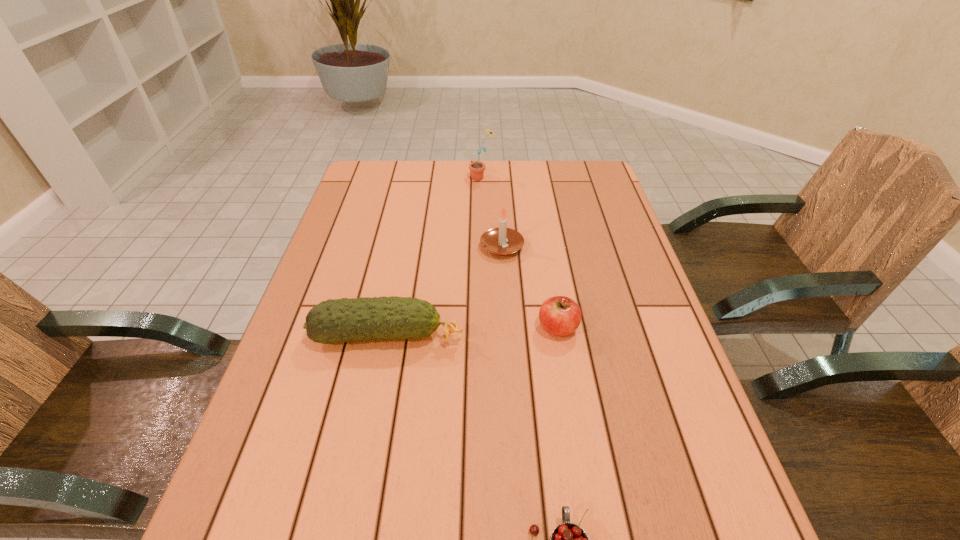
Identify the location of free point between the cucumber and the apple. The image size is (960, 540). (473, 332).

In order to click on free space between the cucumber and the fourth shortest object in this screenshot , I will do `click(444, 291)`.

The width and height of the screenshot is (960, 540). Identify the location of free spot between the cucumber and the candle. (444, 291).

At what (x,y) coordinates should I click in order to perform the action: click on vacant space in between the tallest object and the apple. Please return your answer as a coordinate pair (x, y). Image resolution: width=960 pixels, height=540 pixels. Looking at the image, I should click on (520, 253).

Where is `free spot between the fourth shortest object and the tallest object`? The height and width of the screenshot is (540, 960). free spot between the fourth shortest object and the tallest object is located at coordinates (492, 212).

The image size is (960, 540). Find the location of `object that stands as the third closest to the apple`. object that stands as the third closest to the apple is located at coordinates (568, 539).

Select which object appears as the closest to the cucumber. Please provide its 2D coordinates. Your answer should be formatted as a tuple, i.e. [(x, y)], where the tuple contains the x and y coordinates of a point satisfying the conditions above.

[(560, 316)]

You are a GUI agent. You are given a task and a screenshot of the screen. Output one action in this format:
    pyautogui.click(x=<x>, y=<y>)
    Task: Click on the free point that satisfies the following two spatial constraints: 1. on the back side of the apple; 2. on the flower of the farthest object
    
    Given the screenshot: What is the action you would take?
    pyautogui.click(x=533, y=178)

Locate an element on the screen. vacant position in the image that satisfies the following two spatial constraints: 1. on the flower of the tallest object; 2. on the left side of the second tallest object is located at coordinates (483, 247).

Where is `free space that satisfies the following two spatial constraints: 1. on the flower of the apple; 2. on the left side of the farthest object`? This screenshot has width=960, height=540. free space that satisfies the following two spatial constraints: 1. on the flower of the apple; 2. on the left side of the farthest object is located at coordinates (483, 328).